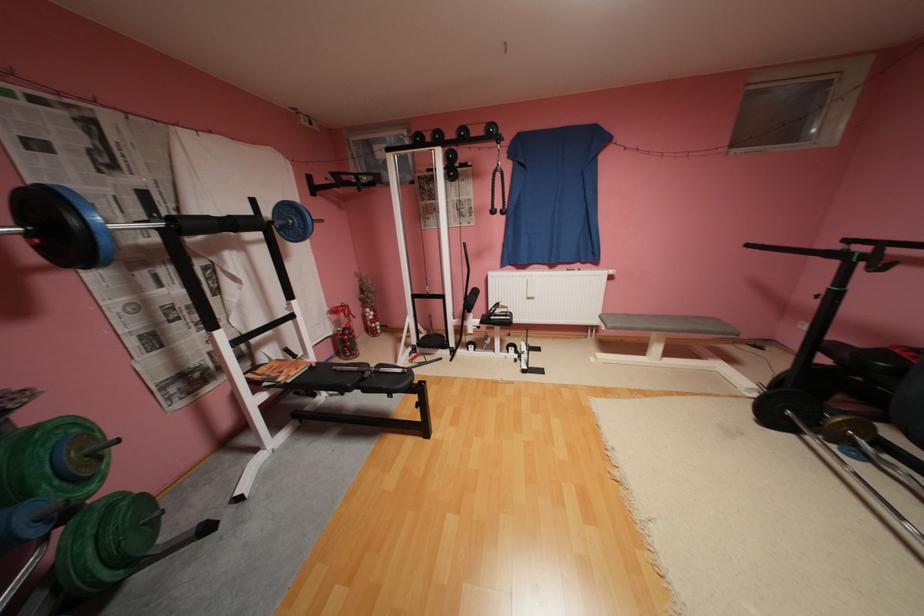
Identify the location of rope pull handle. [x=497, y=191].